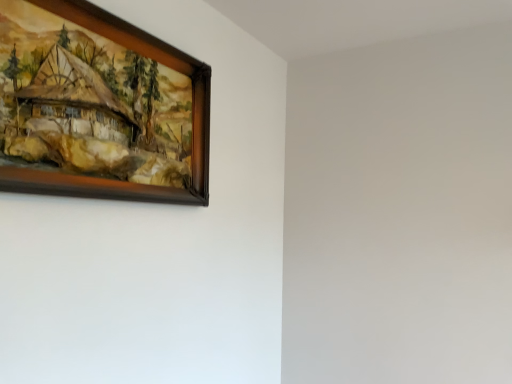
The width and height of the screenshot is (512, 384). I want to click on brown wooden picture frame at upper left, so click(x=99, y=107).

This screenshot has height=384, width=512. Describe the element at coordinates (99, 107) in the screenshot. I see `brown wooden picture frame at upper left` at that location.

At what (x,y) coordinates should I click in order to perform the action: click on brown wooden picture frame at upper left. Please return your answer as a coordinate pair (x, y). The width and height of the screenshot is (512, 384). Looking at the image, I should click on (99, 107).